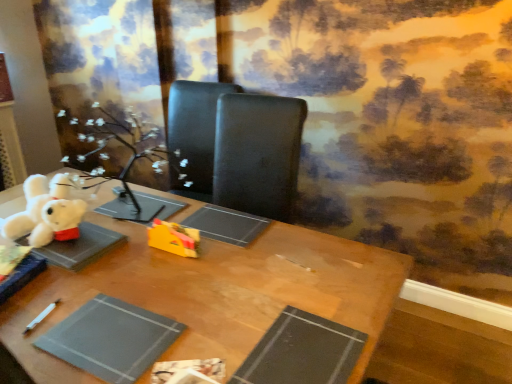
I want to click on empty space that is in between black matte paperback book at lower center, which is counted as the 1th paperback book, starting from the right, and yellow plastic toy at center, which appears as the second toy when viewed from the left, so click(x=213, y=296).